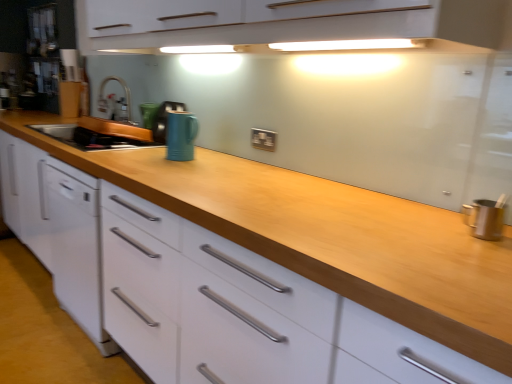
Identify the location of free space that is to the left of metallic silver utensil holder at right. The image size is (512, 384). (421, 226).